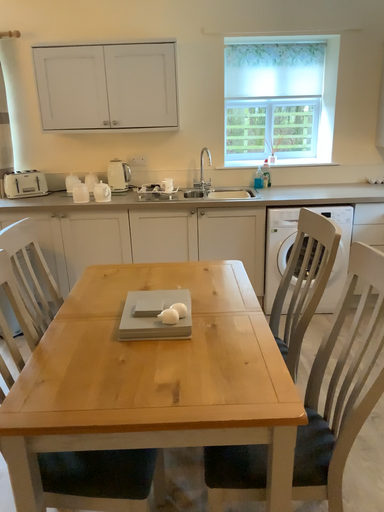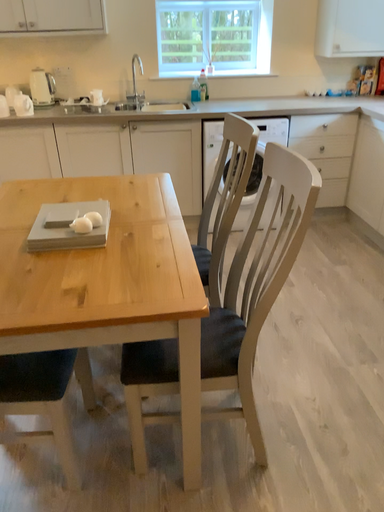
Question: How did the camera likely rotate when shooting the video?

Choices:
 (A) rotated downward
 (B) rotated upward

Answer: (A)